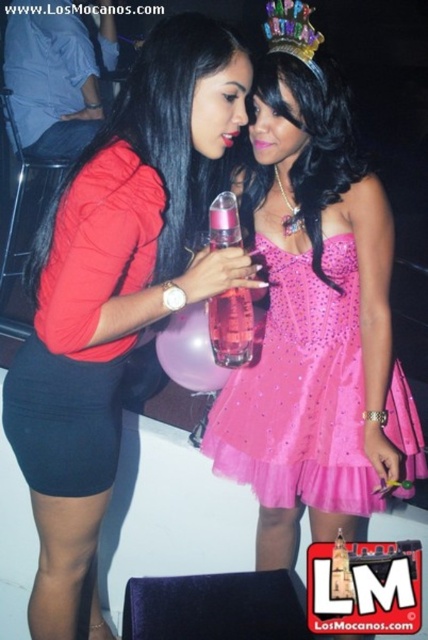
The height and width of the screenshot is (640, 428). What do you see at coordinates (115, 289) in the screenshot? I see `matte black dress at center` at bounding box center [115, 289].

Between matte black dress at center and pink tulle dress at center, which one appears on the left side from the viewer's perspective?

matte black dress at center

The image size is (428, 640). Identify the location of matte black dress at center. (115, 289).

Does pink satin dress at center have a larger size compared to matte black dress at center?

Indeed, pink satin dress at center has a larger size compared to matte black dress at center.

The height and width of the screenshot is (640, 428). Identify the location of pink satin dress at center. (314, 314).

Which of these two, matte black dress at center or pink glass bottle at center, stands shorter?

With less height is pink glass bottle at center.

Is matte black dress at center positioned before pink glass bottle at center?

Yes, it is.

Is point (151, 113) positioned after point (216, 232)?

No, it is in front of (216, 232).

Locate an element on the screen. The image size is (428, 640). matte black dress at center is located at coordinates (115, 289).